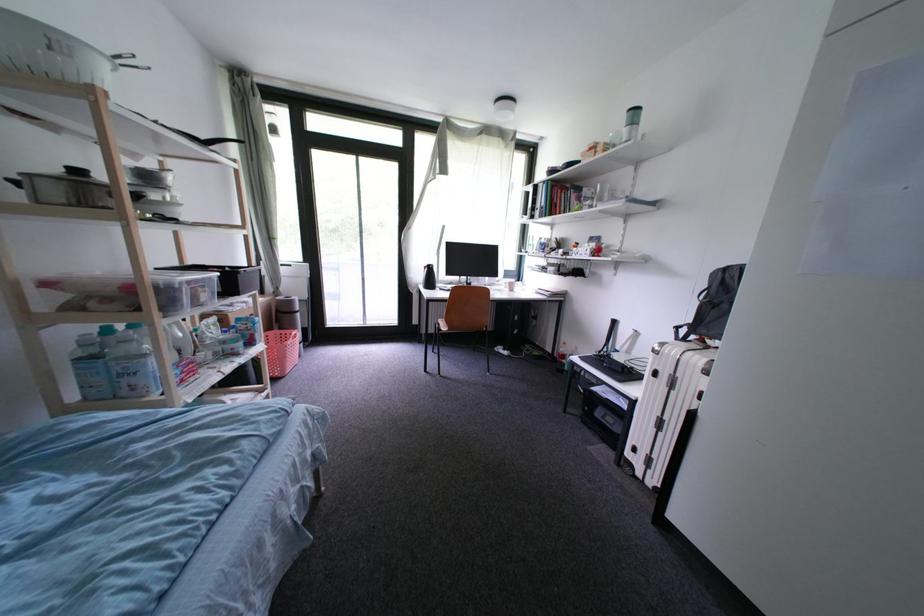
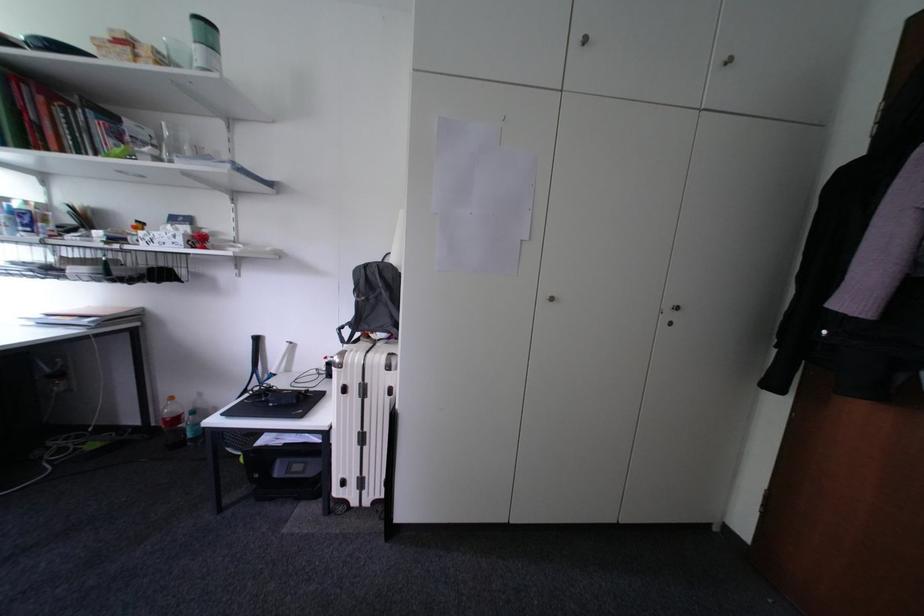
In the second image, find the point that corresponds to point (630, 121) in the first image.

(193, 26)